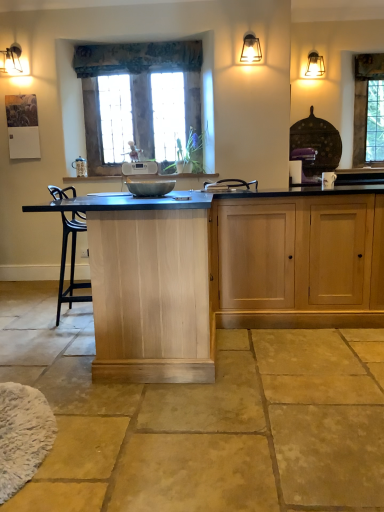
The width and height of the screenshot is (384, 512). I want to click on free space that is in between white fluffy mat at lower left and natural wood cabinet at center, so click(x=98, y=409).